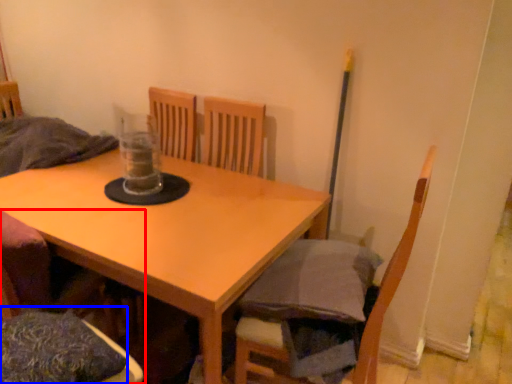
Question: Which object appears farthest to the camera in this image, chair (highlighted by a red box) or pillow (highlighted by a blue box)?

Choices:
 (A) chair
 (B) pillow

Answer: (B)